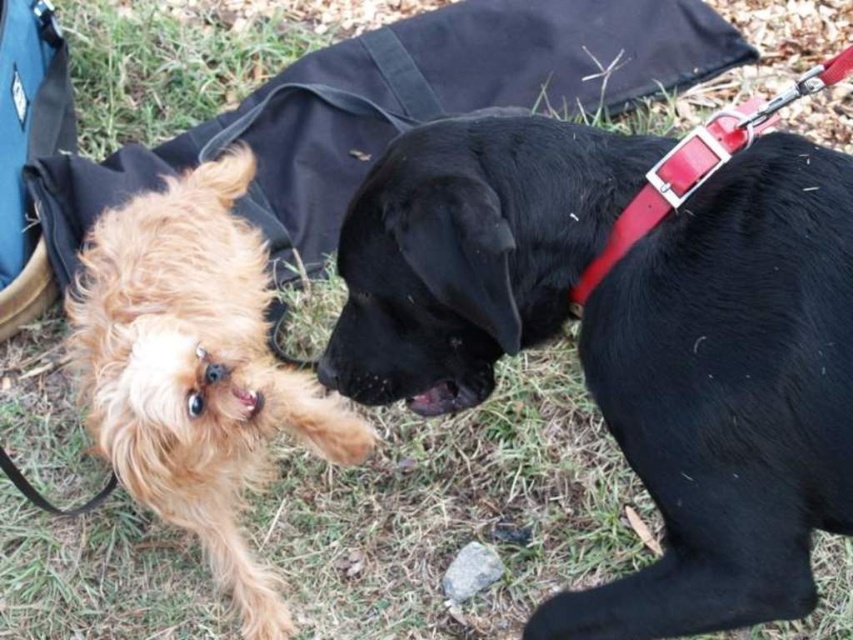
You are a photographer trying to capture a photo of both the black smooth dog at center and the golden fur dog at left. Since you want them both in the frame, which direction should you move your camera to include both dogs?

The black smooth dog at center is positioned on the right side of golden fur dog at left. To include both dogs in the frame, move the camera to the left to capture the golden fur dog at left and then pan towards the right to include the black smooth dog at center.

You are a dog owner trying to decide which dog to adopt. You prefer dogs that are taller. Based on the image, which dog should you choose between the black smooth dog at center and the golden fur dog at left?

The golden fur dog at left is taller than the black smooth dog at center, so you should choose the golden fur dog at left.

You are standing in the grassy area with the two dogs. You notice two points marked in the scene. Which point is closer to you, point (383, 195) or point (229, 218)?

Point (383, 195) is closer to the viewer than point (229, 218).